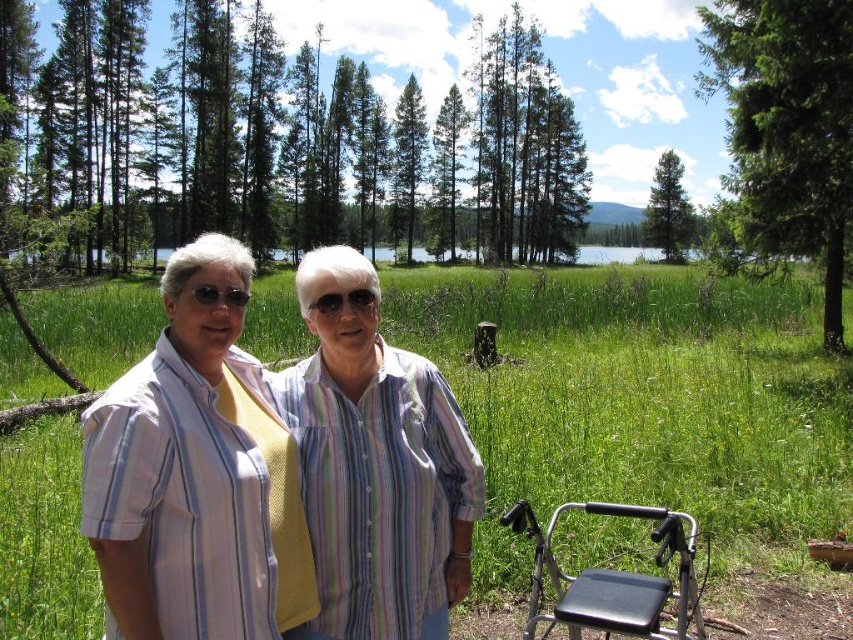
You are planning to set up a picnic area in this outdoor scene. You have a black plastic folding chair at lower right and a green matte tree at upper center. Which object is positioned higher in the image?

The green matte tree at upper center is positioned higher in the image than the black plastic folding chair at lower right.

You are a photographer setting up a tripod in this scene. You need to place it between the green leafy trees at upper center and the black plastic folding chair at lower right. Which object should the tripod be closer to?

The green leafy trees at upper center are closer to the viewer than the black plastic folding chair at lower right, so the tripod should be placed closer to the black plastic folding chair at lower right to maintain equal distance between both objects.